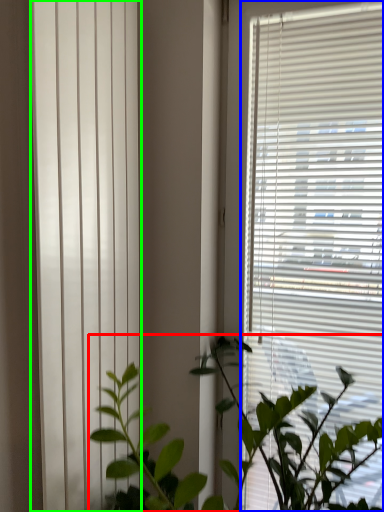
Question: Estimate the real-world distances between objects in this image. Which object is farther from houseplant (highlighted by a red box), window blind (highlighted by a blue box) or shutter (highlighted by a green box)?

Choices:
 (A) window blind
 (B) shutter

Answer: (B)